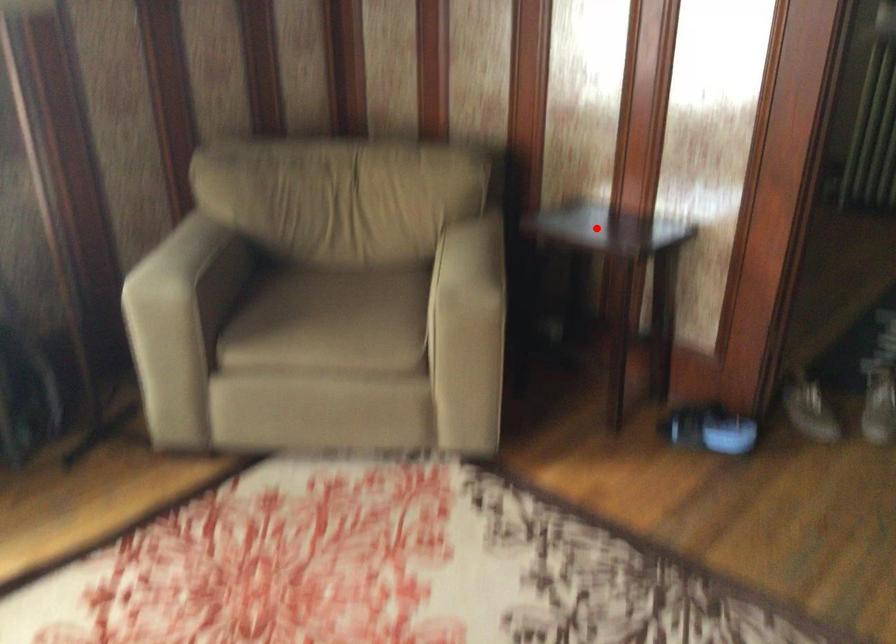
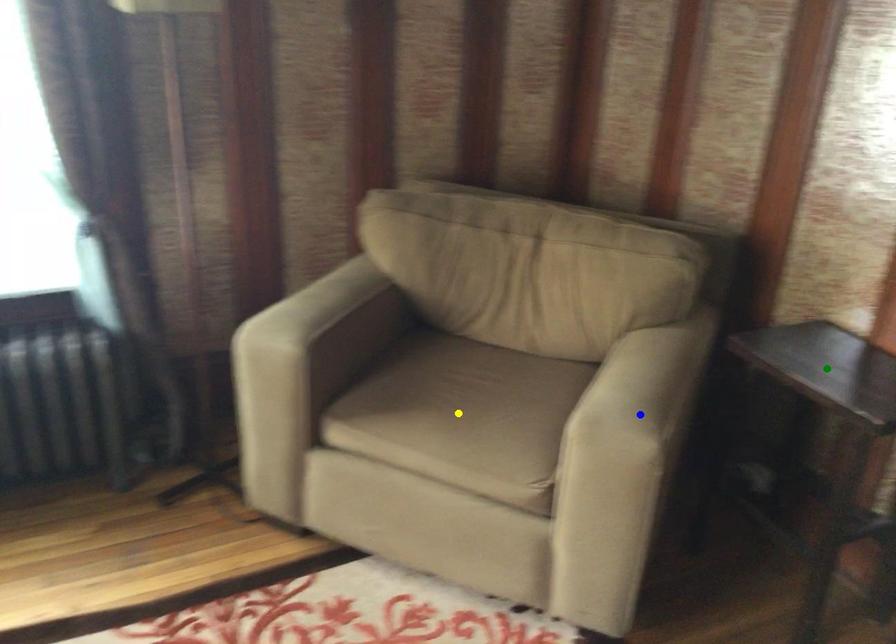
Question: I am providing you with two images of the same scene from different viewpoints. A red point is marked on the first image. You are given multiple points on the second image. Which point in image 2 represents the same 3d spot as the red point in image 1?

Choices:
 (A) yellow point
 (B) green point
 (C) blue point

Answer: (B)